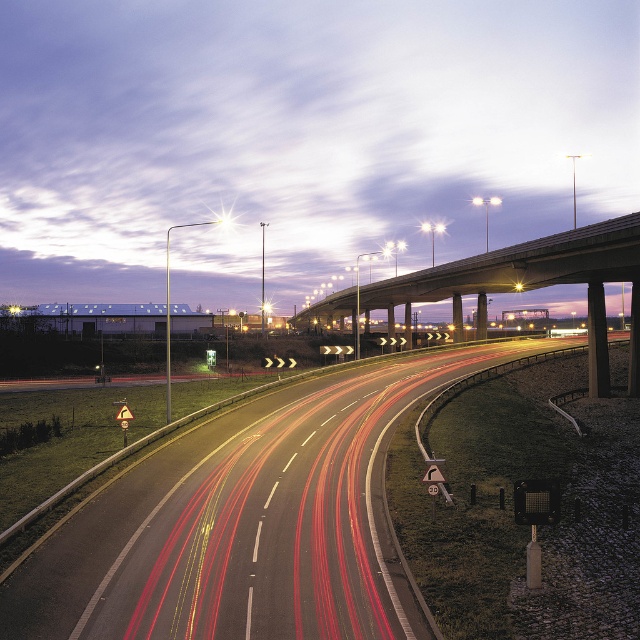
Question: Considering the relative positions of smooth asphalt highway at center and concrete bridge at upper center in the image provided, where is smooth asphalt highway at center located with respect to concrete bridge at upper center?

Choices:
 (A) below
 (B) above

Answer: (A)

Question: Is smooth asphalt highway at center positioned in front of concrete bridge at upper center?

Choices:
 (A) yes
 (B) no

Answer: (A)

Question: Is smooth asphalt highway at center thinner than concrete bridge at upper center?

Choices:
 (A) yes
 (B) no

Answer: (A)